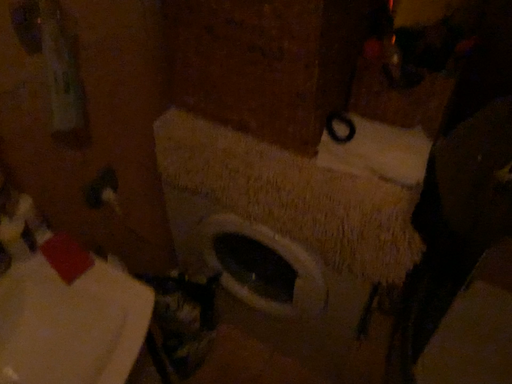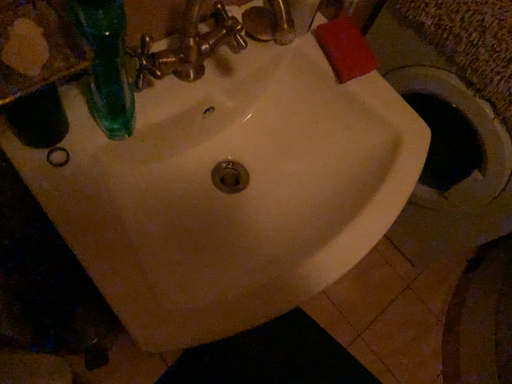
Question: Which way did the camera rotate in the video?

Choices:
 (A) rotated downward
 (B) rotated upward

Answer: (A)